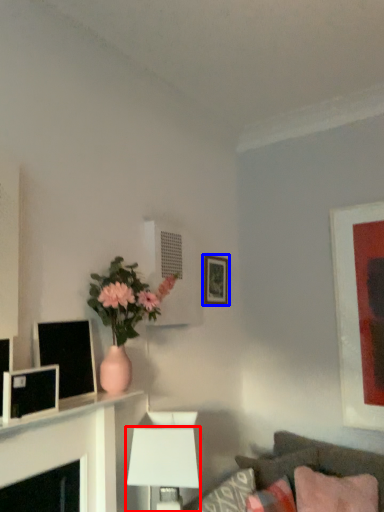
Question: Which point is closer to the camera, table lamp (highlighted by a red box) or picture frame (highlighted by a blue box)?

Choices:
 (A) table lamp
 (B) picture frame

Answer: (A)